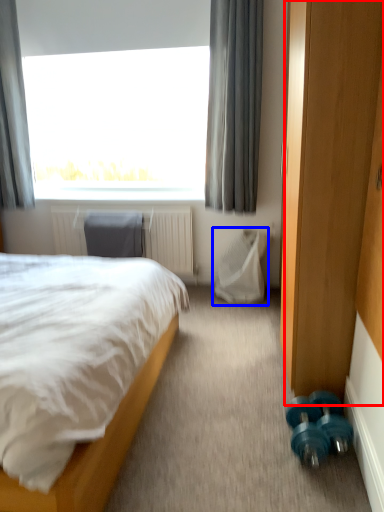
Question: Among these objects, which one is farthest to the camera, screen door (highlighted by a red box) or swivel chair (highlighted by a blue box)?

Choices:
 (A) screen door
 (B) swivel chair

Answer: (B)